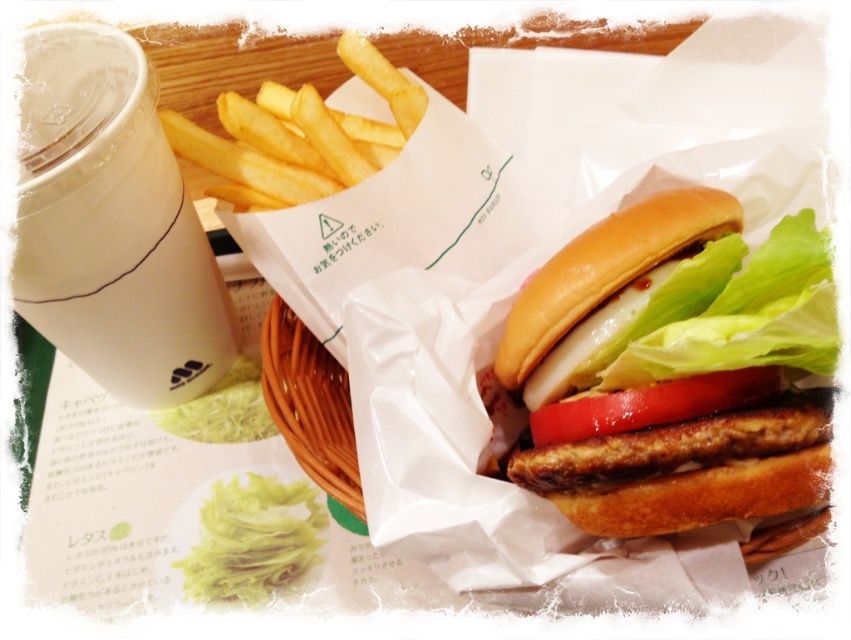
Question: Does golden brown bun at center appear on the left side of red matte tomato at center?

Choices:
 (A) yes
 (B) no

Answer: (B)

Question: Which object is closer to the camera taking this photo?

Choices:
 (A) golden brown bun at center
 (B) red matte tomato at center

Answer: (A)

Question: Which of the following is the closest to the observer?

Choices:
 (A) (255, 116)
 (B) (678, 264)
 (C) (312, 342)
 (D) (735, 330)

Answer: (D)

Question: From the image, what is the correct spatial relationship of green leafy lettuce at center in relation to yellow crispy french fries at upper left?

Choices:
 (A) above
 (B) below

Answer: (B)

Question: Is white paper cup at upper left thinner than red matte tomato at center?

Choices:
 (A) no
 (B) yes

Answer: (A)

Question: Among these points, which one is nearest to the camera?

Choices:
 (A) (657, 440)
 (B) (734, 337)
 (C) (41, 253)

Answer: (B)